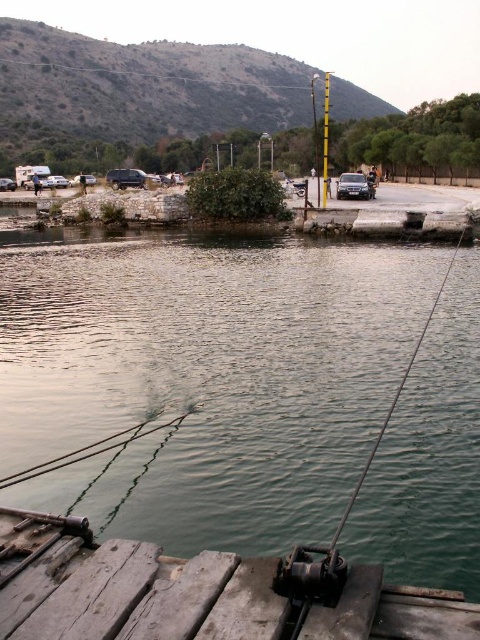
Which of these two, greenish water at center or smooth wire fishing rod at center, stands taller?

Standing taller between the two is smooth wire fishing rod at center.

Between greenish water at center and smooth wire fishing rod at center, which one has less height?

Standing shorter between the two is greenish water at center.

Locate an element on the screen. This screenshot has width=480, height=640. greenish water at center is located at coordinates (204, 378).

Does greenish water at center have a smaller size compared to weathered wood dock at lower left?

Actually, greenish water at center might be larger than weathered wood dock at lower left.

Who is positioned more to the right, greenish water at center or weathered wood dock at lower left?

From the viewer's perspective, weathered wood dock at lower left appears more on the right side.

Image resolution: width=480 pixels, height=640 pixels. Find the location of `greenish water at center`. greenish water at center is located at coordinates (204, 378).

Locate an element on the screen. greenish water at center is located at coordinates (204, 378).

Does point (391, 410) lie in front of point (325, 88)?

Yes, it is.

Measure the distance between smooth wire fishing rod at center and yellow painted metal pole at center.

The distance of smooth wire fishing rod at center from yellow painted metal pole at center is 69.58 meters.

Who is more distant from viewer, (373, 445) or (324, 124)?

The point (324, 124) is behind.

Find the location of a particular element. smooth wire fishing rod at center is located at coordinates (387, 413).